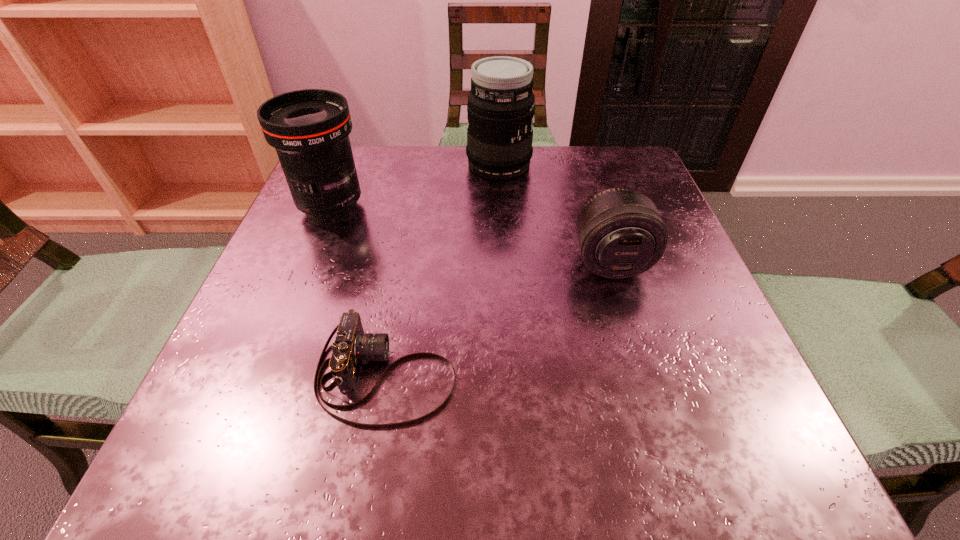
Locate an element on the screen. This screenshot has height=540, width=960. unoccupied area between the shortest telephoto lens and the farthest telephoto lens is located at coordinates (555, 213).

You are a GUI agent. You are given a task and a screenshot of the screen. Output one action in this format:
    pyautogui.click(x=<x>, y=<y>)
    Task: Click on the free spot between the third farthest object and the farthest telephoto lens
    The width and height of the screenshot is (960, 540).
    Given the screenshot: What is the action you would take?
    coord(555,213)

At what (x,y) coordinates should I click in order to perform the action: click on unoccupied area between the farthest telephoto lens and the nearest telephoto lens. Please return your answer as a coordinate pair (x, y). Looking at the image, I should click on (555, 213).

The image size is (960, 540). In order to click on vacant area between the camera and the farthest object in this screenshot , I will do `click(443, 270)`.

Locate an element on the screen. The width and height of the screenshot is (960, 540). empty space between the shortest telephoto lens and the farthest telephoto lens is located at coordinates (555, 213).

At what (x,y) coordinates should I click in order to perform the action: click on the third closest object to the nearest object. Please return your answer as a coordinate pair (x, y). Looking at the image, I should click on 501,104.

Locate an element on the screen. The width and height of the screenshot is (960, 540). object that is the third closest one to the second telephoto lens from right to left is located at coordinates (352, 346).

Image resolution: width=960 pixels, height=540 pixels. I want to click on telephoto lens that stands as the second closest to the second farthest object, so click(620, 234).

This screenshot has height=540, width=960. Find the location of `telephoto lens that is the closest to the shortest object`. telephoto lens that is the closest to the shortest object is located at coordinates (620, 234).

Image resolution: width=960 pixels, height=540 pixels. Identify the location of free space that satisfies the following two spatial constraints: 1. on the front-facing side of the shortest telephoto lens; 2. on the front-facing side of the shortest object. (644, 374).